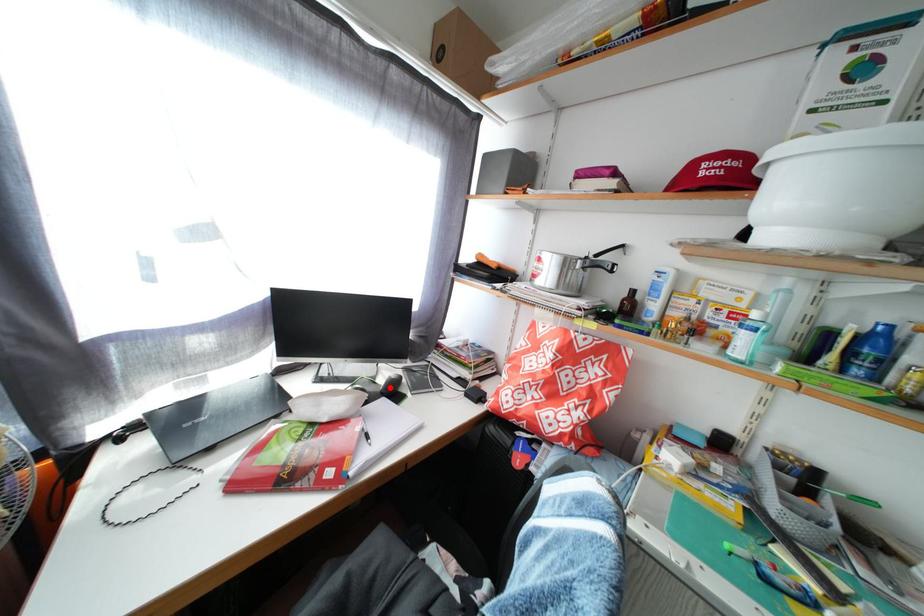
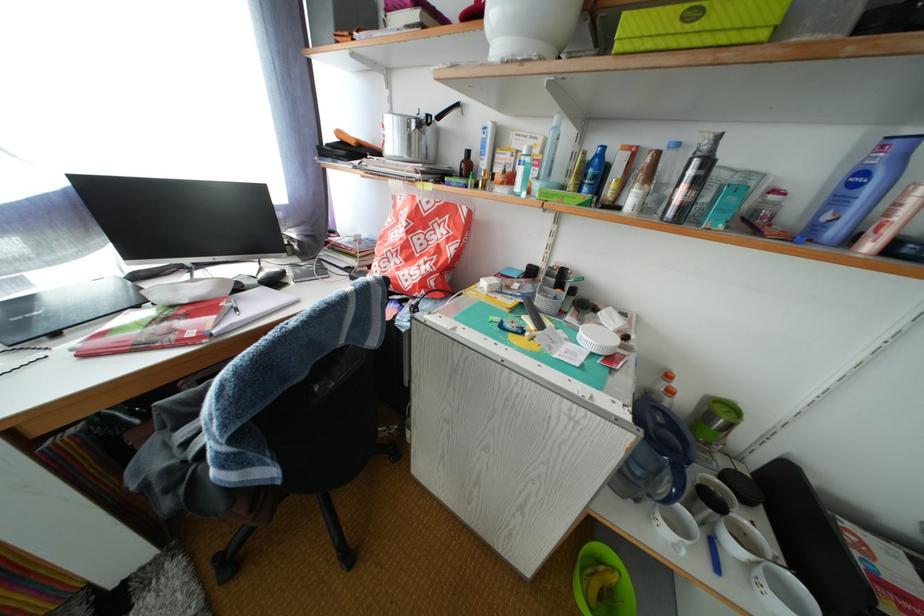
Question: I am providing you with two images of the same scene from different viewpoints. A red point is marked on the first image. Can you still see the location of the red point in image 2?

Choices:
 (A) Yes
 (B) No

Answer: (B)